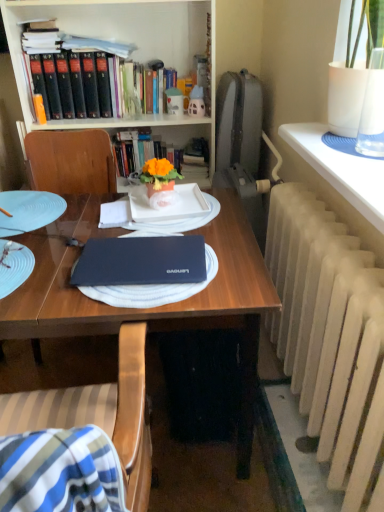
Question: From their relative heights in the image, would you say white textured radiator at right, the 1th table positioned from the front, is taller or shorter than white matte plate at center?

Choices:
 (A) short
 (B) tall

Answer: (B)

Question: Considering the positions of white textured radiator at right, the 1th table positioned from the front, and white matte plate at center in the image, is white textured radiator at right, the 1th table positioned from the front, wider or thinner than white matte plate at center?

Choices:
 (A) thin
 (B) wide

Answer: (B)

Question: Which of these objects is positioned farthest from the matte black bookcase at upper left?

Choices:
 (A) orange matte flower pot at center
 (B) matte black laptop at center
 (C) glossy brown table at center, acting as the 2th table starting from the right
 (D) matte black laptop at center
 (E) white painted radiator at right

Answer: (D)

Question: Which is farther from the matte black laptop at center?

Choices:
 (A) white painted radiator at right
 (B) blue matte glass plate at left
 (C) matte black laptop at center
 (D) glossy brown table at center, placed as the 1th table when sorted from back to front
 (E) white matte plate at center

Answer: (B)